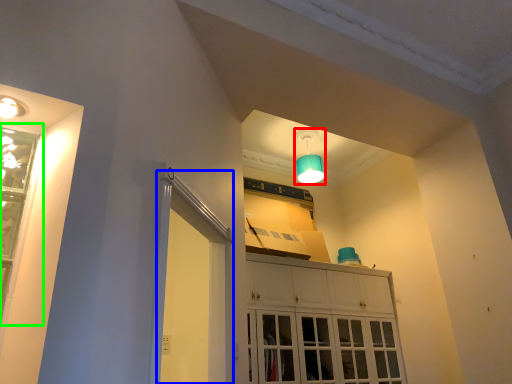
Question: Which object is the farthest from lamp (highlighted by a red box)? Choose among these: screen door (highlighted by a blue box) or window (highlighted by a green box).

Choices:
 (A) screen door
 (B) window

Answer: (B)